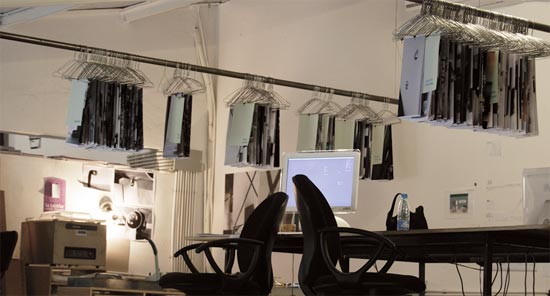
The image size is (550, 296). Find the location of `table`. table is located at coordinates (469, 233).